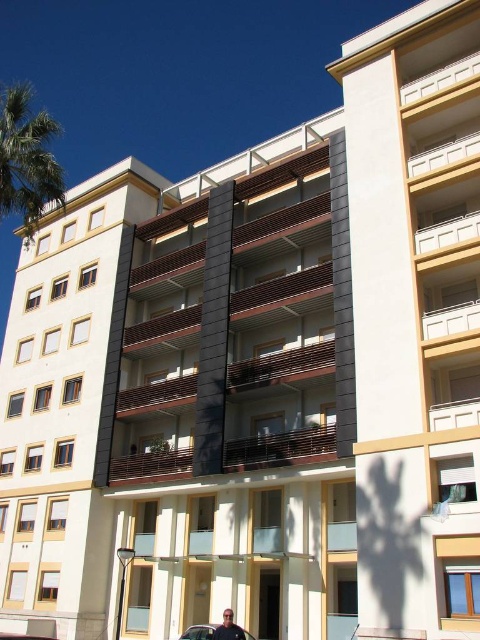
Can you confirm if brown wooden balcony at center is thinner than dark blue shirt at lower center?

No, brown wooden balcony at center is not thinner than dark blue shirt at lower center.

Is point (277, 381) positioned before point (228, 637)?

No, (277, 381) is further to viewer.

Find the location of `brown wooden balcony at center`. brown wooden balcony at center is located at coordinates (240, 332).

Identify the location of brown wooden balcony at center. Image resolution: width=480 pixels, height=640 pixels. (240, 332).

How far apart are dark blue shirt at lower center and shiny black sedan at lower center?

The distance of dark blue shirt at lower center from shiny black sedan at lower center is 1.61 meters.

Measure the distance between point (240,628) and camera.

Point (240,628) and camera are 33.67 meters apart.

Is point (225, 621) positioned behind point (202, 634)?

No.

Find the location of a particular element. Image resolution: width=480 pixels, height=640 pixels. dark blue shirt at lower center is located at coordinates (228, 627).

Between point (38, 180) and point (208, 628), which one is positioned in front?

Point (208, 628) is more forward.

Is green leafy palm tree at upper left thinner than shiny black sedan at lower center?

In fact, green leafy palm tree at upper left might be wider than shiny black sedan at lower center.

The width and height of the screenshot is (480, 640). What are the coordinates of `green leafy palm tree at upper left` in the screenshot? It's located at (26, 157).